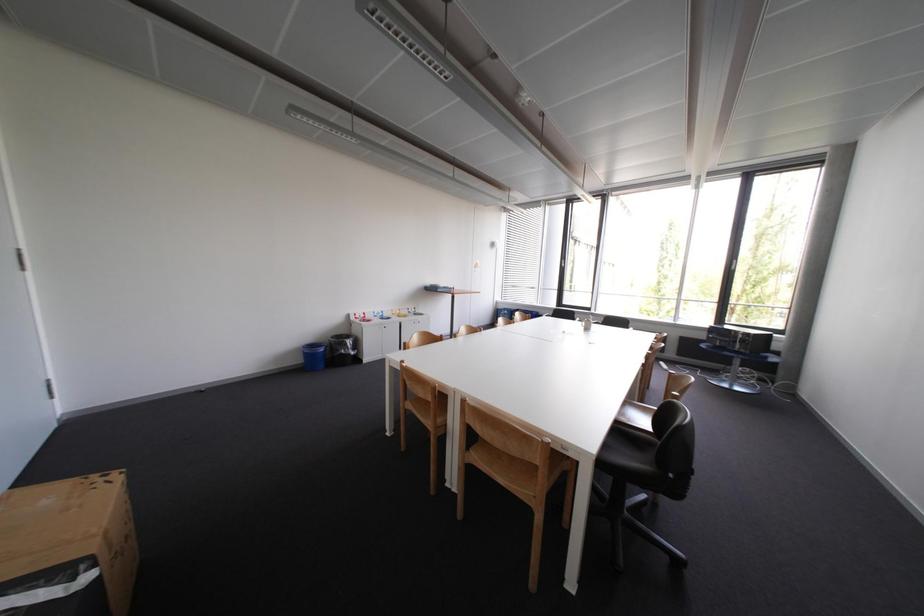
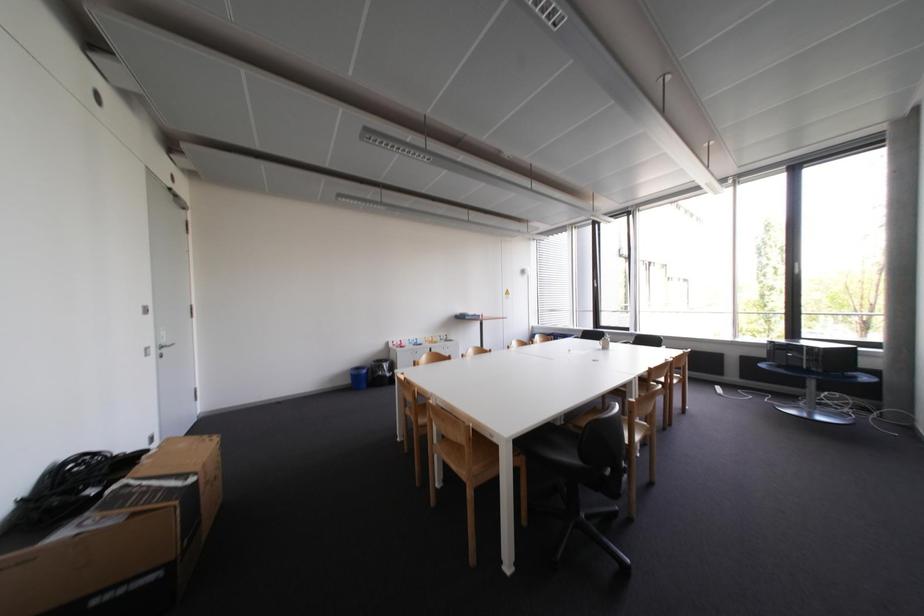
The images are taken continuously from a first-person perspective. In which direction are you moving?

The movement direction of the cameraman is right, backward.